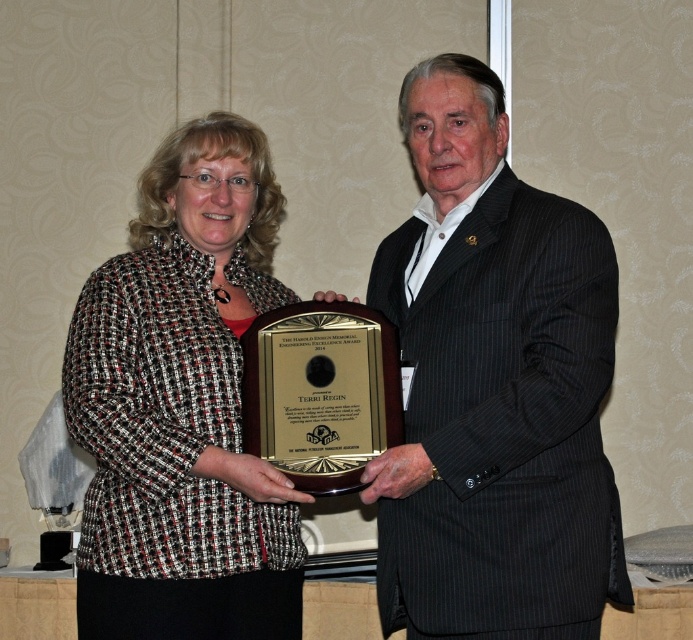
Question: Which of the following is the closest to the observer?

Choices:
 (A) (193, 432)
 (B) (446, 516)

Answer: (B)

Question: Can you confirm if black pinstripe suit at center is positioned to the right of tweed jacket at center?

Choices:
 (A) yes
 (B) no

Answer: (A)

Question: Can you confirm if black pinstripe suit at center is wider than tweed jacket at center?

Choices:
 (A) no
 (B) yes

Answer: (A)

Question: Which point appears closest to the camera in this image?

Choices:
 (A) (520, 376)
 (B) (252, 246)

Answer: (A)

Question: Is black pinstripe suit at center to the right of tweed jacket at center from the viewer's perspective?

Choices:
 (A) no
 (B) yes

Answer: (B)